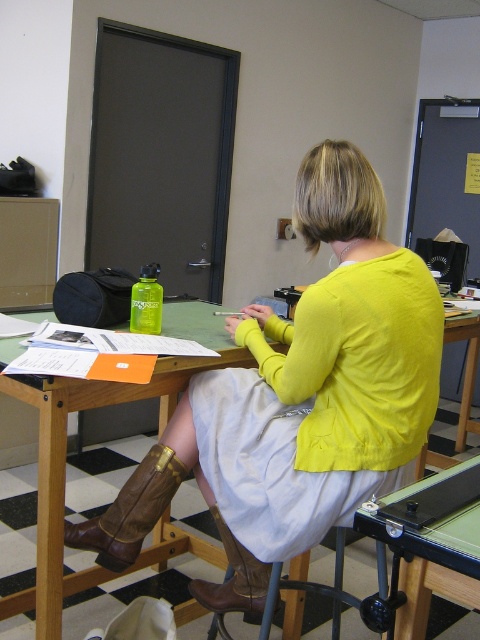
You are organizing a charity event and need to pack items from the table. The matte yellow sweater at center and brown leather boot at lower left are both on the table. Which item takes up more space on the table?

The matte yellow sweater at center takes up more space on the table than the brown leather boot at lower left because it is larger in size according to the description.

You are standing in the office and want to locate the matte yellow sweater at center. According to the coordinates provided, where should you look?

The matte yellow sweater at center is located at coordinates point (299, 397).

You are trying to organize the items under the table. The brown leather boot at lower left and the brown leather boot at lower center are both in your way. Which boot should you move first to free up space?

You should move the brown leather boot at lower left first because it is located above the brown leather boot at lower center, so moving the upper one will allow access to the lower one.